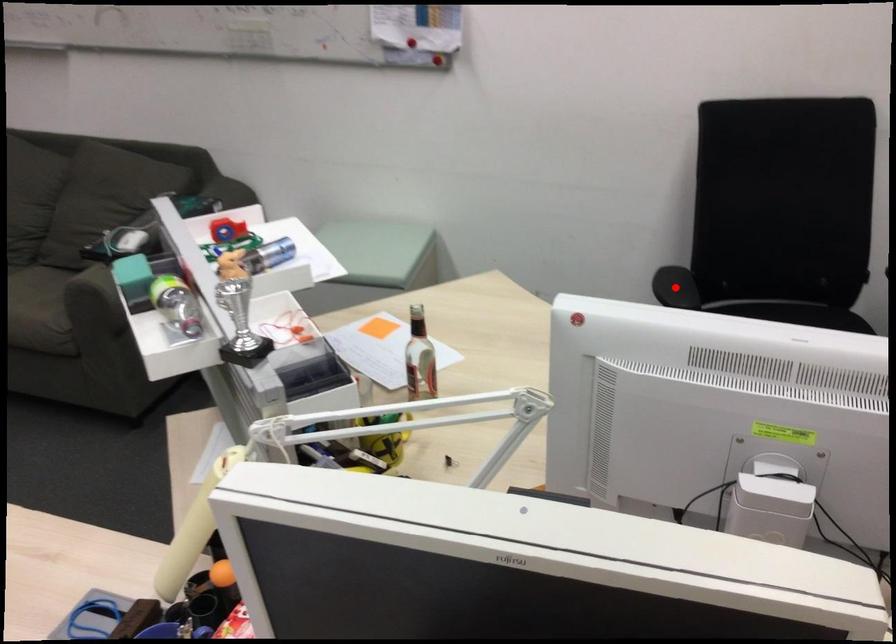
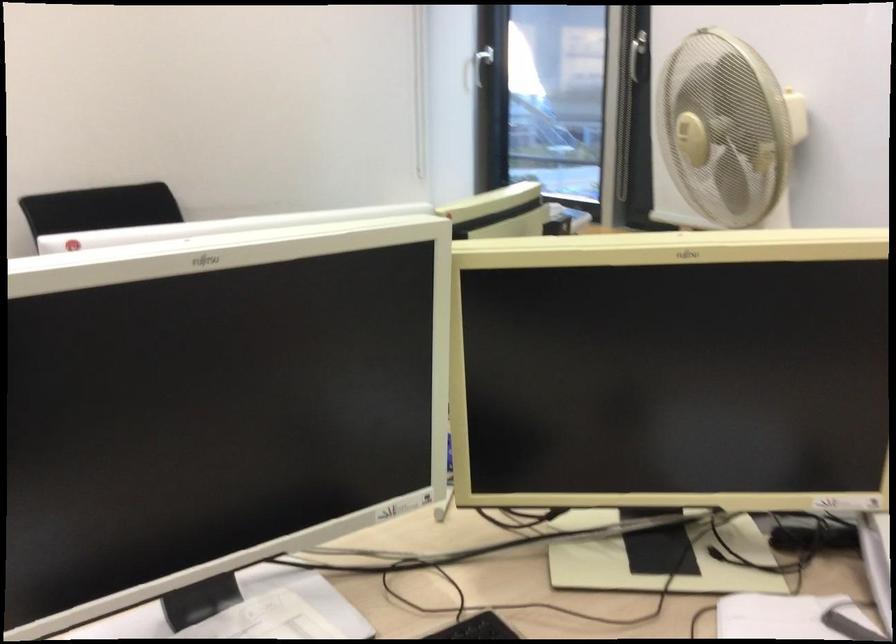
Question: I am providing you with two images of the same scene from different viewpoints. A red point is marked on the first image. Is the red point's position out of view in image 2?

Choices:
 (A) Yes
 (B) No

Answer: (A)